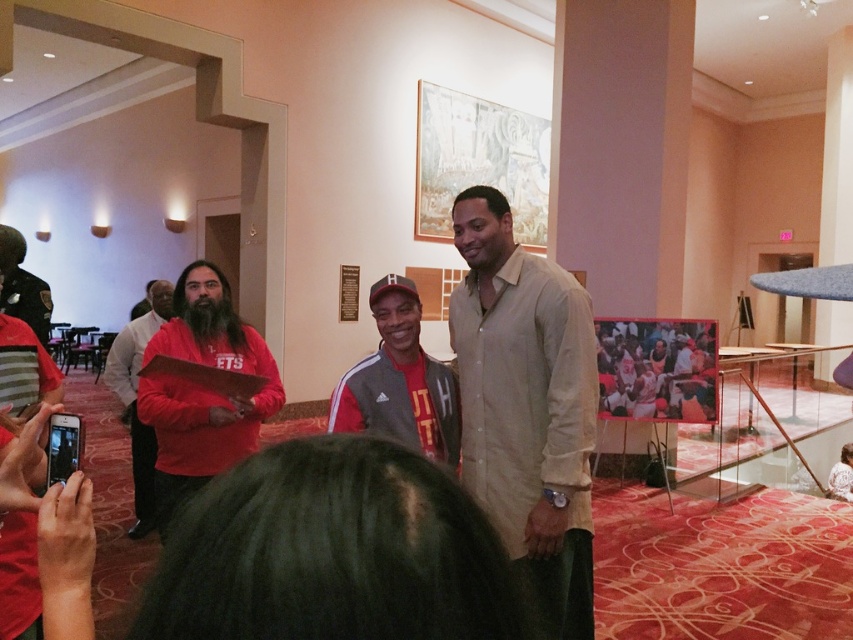
Question: Is beige cotton shirt at center thinner than red adidas jacket at center?

Choices:
 (A) no
 (B) yes

Answer: (A)

Question: Which object is farther from the camera taking this photo?

Choices:
 (A) red matte jacket at center
 (B) beige cotton shirt at center

Answer: (A)

Question: Can you confirm if beige cotton shirt at center is bigger than matte red sweatshirt at center?

Choices:
 (A) yes
 (B) no

Answer: (A)

Question: Which object is closer to the camera taking this photo?

Choices:
 (A) matte red sweatshirt at center
 (B) red matte jacket at center

Answer: (A)

Question: Is red adidas jacket at center smaller than red matte jacket at center?

Choices:
 (A) yes
 (B) no

Answer: (A)

Question: Which object is the farthest from the matte red sweatshirt at center?

Choices:
 (A) red adidas jacket at center
 (B) red matte jacket at center
 (C) beige cotton shirt at center

Answer: (B)